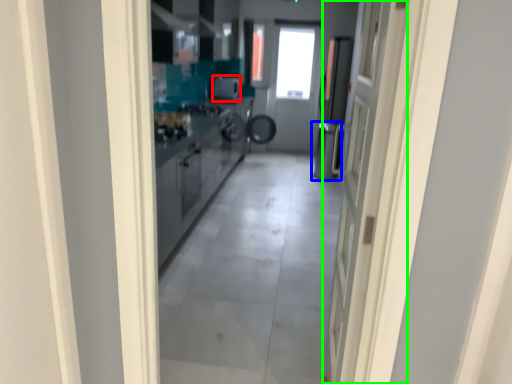
Question: Which is farther away from appliance (highlighted by a red box)? dish washer (highlighted by a blue box) or door (highlighted by a green box)?

Choices:
 (A) dish washer
 (B) door

Answer: (B)